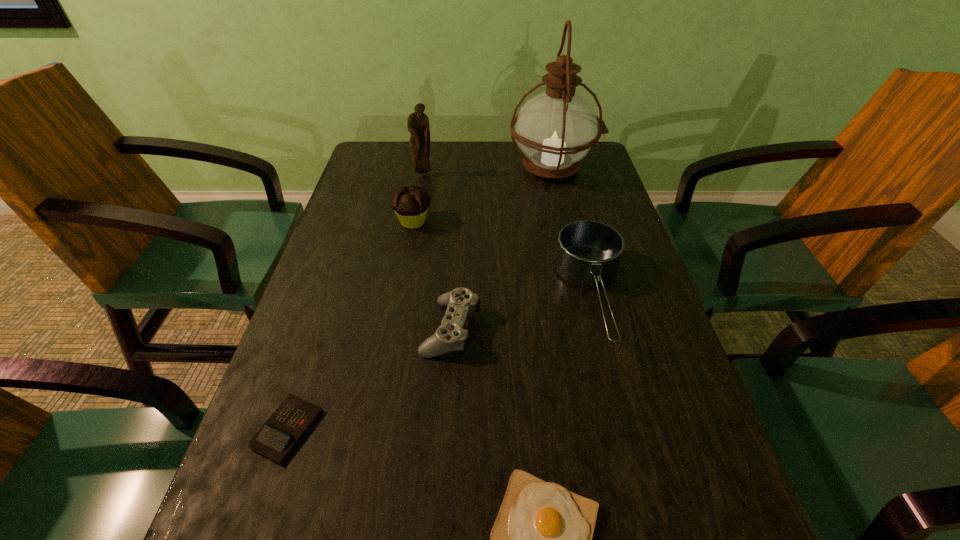
You are a GUI agent. You are given a task and a screenshot of the screen. Output one action in this format:
    pyautogui.click(x=<x>, y=<y>)
    Task: Click on the oil lamp
    This screenshot has width=960, height=540.
    Given the screenshot: What is the action you would take?
    pyautogui.click(x=557, y=128)

In order to click on figurine in this screenshot , I will do [x=418, y=125].

The width and height of the screenshot is (960, 540). In order to click on the fifth nearest object in this screenshot , I will do `click(410, 204)`.

This screenshot has height=540, width=960. Identify the location of saucepan. (588, 254).

At what (x,y) coordinates should I click in order to perform the action: click on control. Please return your answer as a coordinate pair (x, y). The width and height of the screenshot is (960, 540). Looking at the image, I should click on (451, 335).

In order to click on the fourth object from left to right in this screenshot , I will do `click(451, 335)`.

Identify the location of calculator. (278, 436).

Identify the location of the second nearest object. This screenshot has height=540, width=960. (278, 436).

Find the location of a particular element. The image size is (960, 540). vacant area situated 0.120m on the front of the tallest object is located at coordinates (564, 219).

Find the location of a particular element. Image resolution: width=960 pixels, height=540 pixels. vacant space located 0.320m on the front-facing side of the figurine is located at coordinates (411, 247).